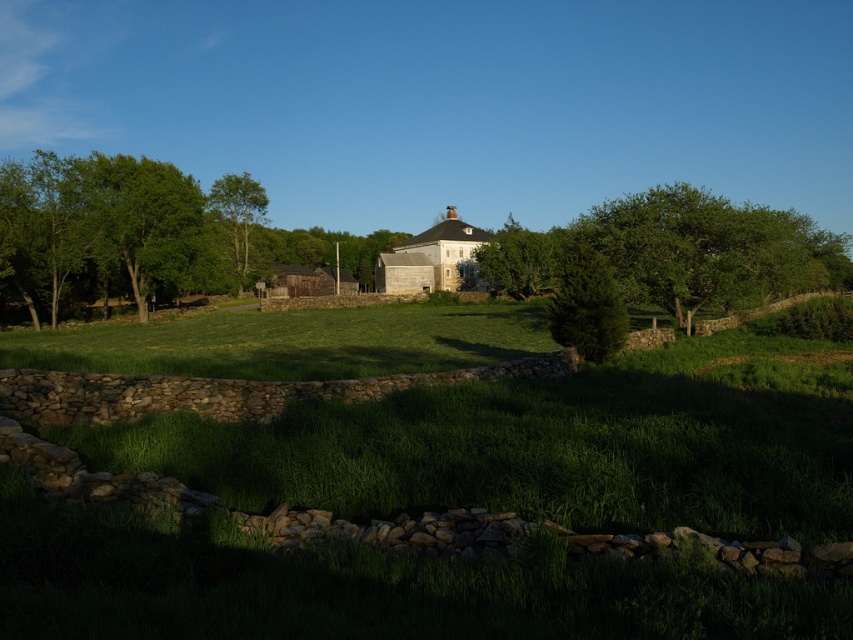
Question: Observing the image, what is the correct spatial positioning of green leafy tree at left in reference to green leafy tree at upper right?

Choices:
 (A) below
 (B) above

Answer: (B)

Question: Can you confirm if green leafy tree at upper right is wider than green leafy tree at center?

Choices:
 (A) no
 (B) yes

Answer: (B)

Question: Which object is closer to the camera taking this photo?

Choices:
 (A) green leafy tree at upper left
 (B) green leafy tree at left

Answer: (B)

Question: Does green leafy tree at upper right have a larger size compared to green leafy tree at upper left?

Choices:
 (A) yes
 (B) no

Answer: (A)

Question: Which object is positioned closest to the green leafy tree at center?

Choices:
 (A) green leafy tree at upper left
 (B) green leafy tree at left
 (C) green leafy tree at upper right

Answer: (C)

Question: Estimate the real-world distances between objects in this image. Which object is closer to the green leafy tree at left?

Choices:
 (A) green leafy tree at upper right
 (B) green leafy tree at center

Answer: (B)